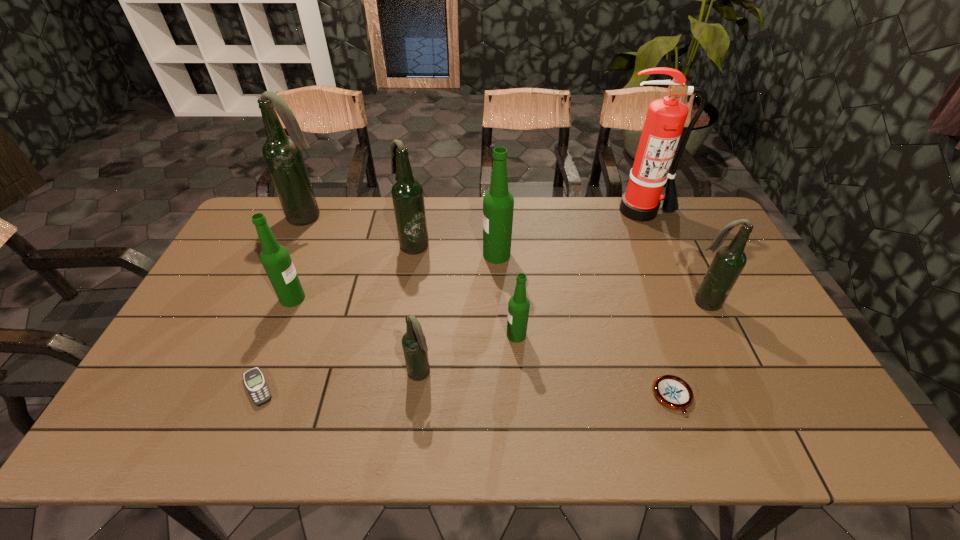
Locate an element on the screen. The height and width of the screenshot is (540, 960). fire extinguisher is located at coordinates (665, 119).

The image size is (960, 540). I want to click on the leftmost dark beer bottle, so click(282, 154).

The image size is (960, 540). What are the coordinates of `the biggest dark beer bottle` in the screenshot? It's located at tap(282, 154).

This screenshot has width=960, height=540. I want to click on the biggest green beer bottle, so coord(498,203).

In order to click on the second biggest dark beer bottle in this screenshot , I will do `click(407, 193)`.

Identify the location of the second nearest green beer bottle. This screenshot has width=960, height=540. (275, 258).

Identify the location of the second smallest green beer bottle. This screenshot has height=540, width=960. coord(275,258).

What are the coordinates of `the rightmost beer bottle` in the screenshot? It's located at (729, 261).

This screenshot has width=960, height=540. What are the coordinates of `the third biggest dark beer bottle` in the screenshot? It's located at (729, 261).

Locate an element on the screen. This screenshot has height=540, width=960. the nearest green beer bottle is located at coordinates (518, 307).